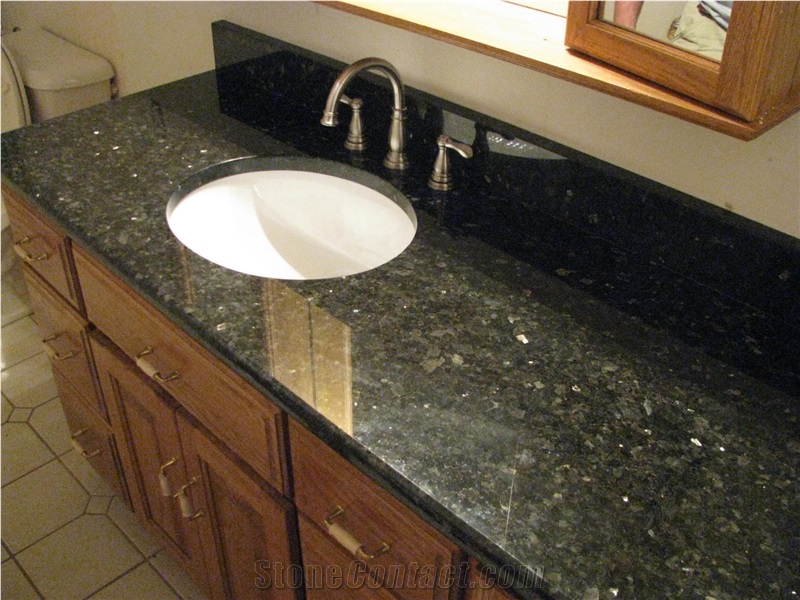
Locate an element on the screen. The image size is (800, 600). counter is located at coordinates (614, 366).